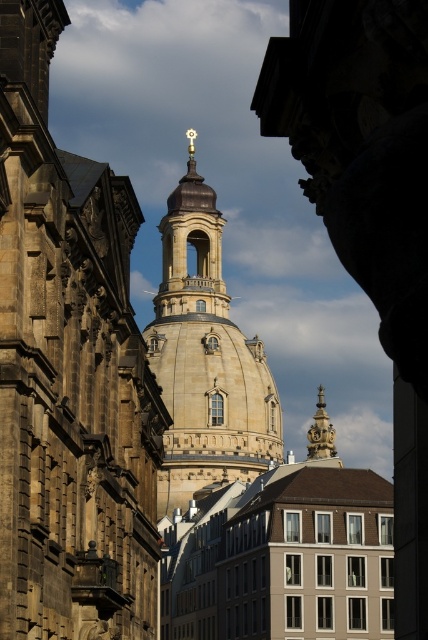
You are standing in front of the stone church at center and the stone tower at center. Which one is positioned lower in the image?

The stone church at center is below the stone tower at center, so it is positioned lower in the image.

You are standing in a historic urban area and see the stone church at center. If you want to take a photo of the dome with the golden cross at its apex, where should you position yourself relative to the church?

The stone church at center is located at point [68,372], so you should position yourself directly in front of the stone church at center to capture the dome and its golden cross clearly.

You are standing at the camera position in front of the stone church at center. You want to take a photo of the entire dome structure without any obstructions. Given that your camera has a maximum zoom range of 100 meters, can you capture the entire dome structure in one shot?

The stone church at center and camera are 46.92 meters apart from each other. Since the maximum zoom range of the camera is 100 meters, which is greater than the distance between them, you can capture the entire dome structure in one shot without any obstructions.